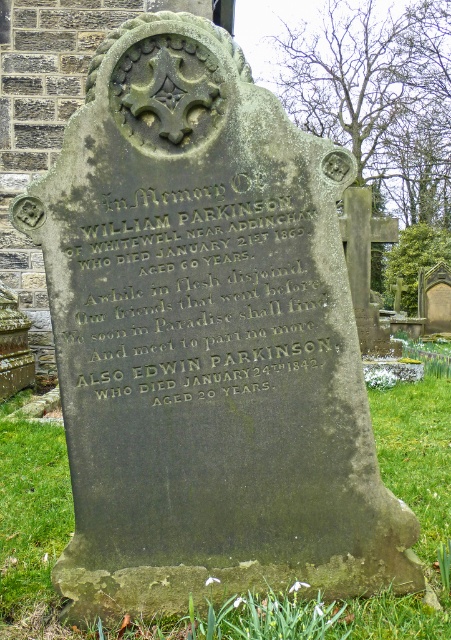
Is black stone inscription at center below green grass at lower center?

Incorrect, black stone inscription at center is not positioned below green grass at lower center.

Does black stone inscription at center appear over green grass at lower center?

Yes.

Which is behind, point (170, 225) or point (38, 509)?

The point (38, 509) is behind.

You are a GUI agent. You are given a task and a screenshot of the screen. Output one action in this format:
    pyautogui.click(x=<x>, y=<y>)
    Task: Click on the black stone inscription at center
    The image size is (451, 640).
    Given the screenshot: What is the action you would take?
    pyautogui.click(x=193, y=292)